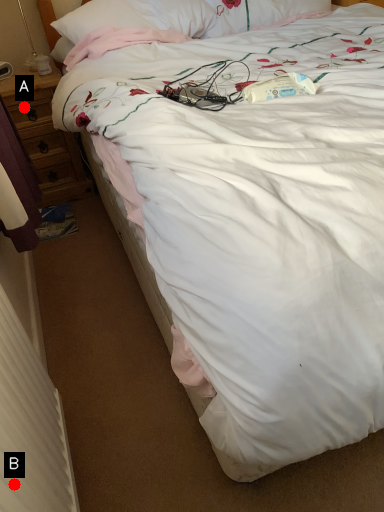
Question: Two points are circled on the image, labeled by A and B beside each circle. Which point is farther to the camera?

Choices:
 (A) A is further
 (B) B is further

Answer: (A)